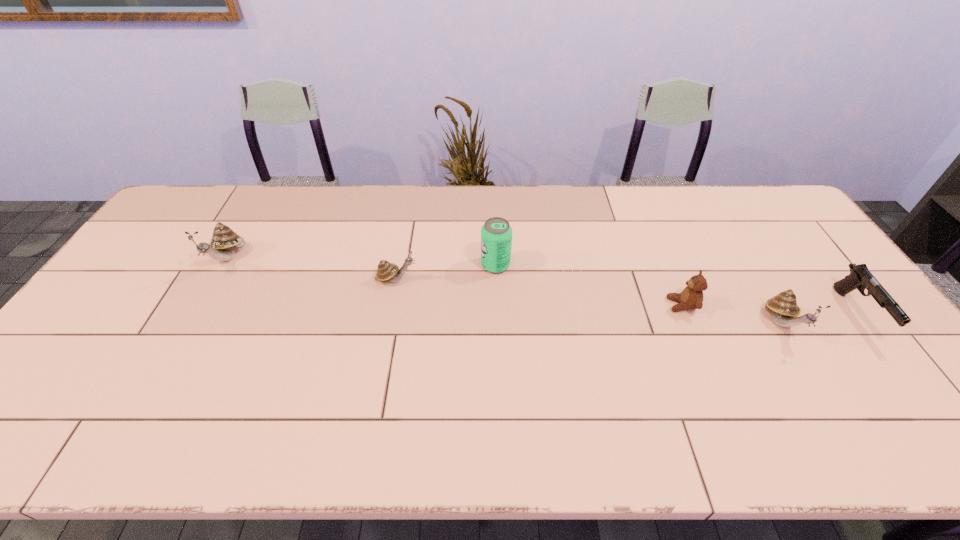
Locate an element on the screen. The width and height of the screenshot is (960, 540). free point between the pop soda and the teddy bear is located at coordinates (588, 285).

Identify the location of vacant area that lies between the teddy bear and the leftmost object. The height and width of the screenshot is (540, 960). (455, 282).

The width and height of the screenshot is (960, 540). What are the coordinates of `blank region between the gun and the pop soda` in the screenshot? It's located at (676, 289).

Locate an element on the screen. object that stands as the third closest to the second object from left to right is located at coordinates (691, 297).

I want to click on object that is the fourth nearest to the leftmost snail, so click(783, 306).

Identify the location of the second closest snail relative to the nearest snail. This screenshot has height=540, width=960. (224, 242).

You are a GUI agent. You are given a task and a screenshot of the screen. Output one action in this format:
    pyautogui.click(x=<x>, y=<y>)
    Task: Click on the third closest snail to the rightmost object
    This screenshot has height=540, width=960.
    Given the screenshot: What is the action you would take?
    pyautogui.click(x=224, y=242)